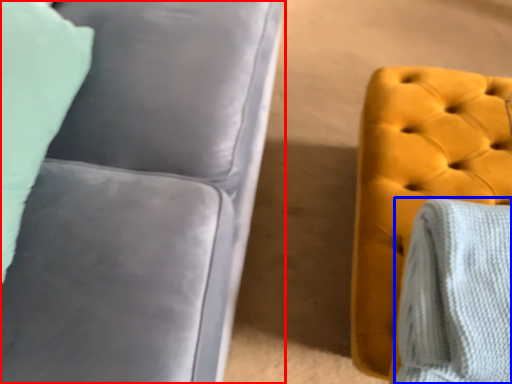
Question: Among these objects, which one is farthest to the camera, studio couch (highlighted by a red box) or blanket (highlighted by a blue box)?

Choices:
 (A) studio couch
 (B) blanket

Answer: (B)